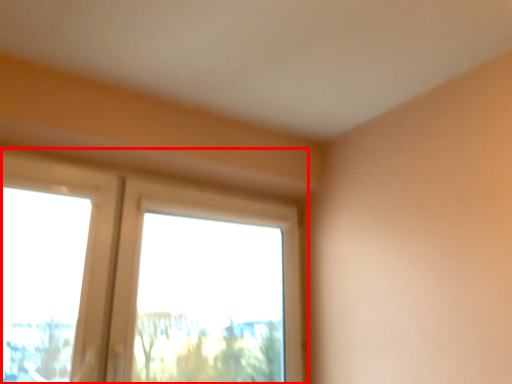
Question: In this image, where is window (annotated by the red box) located relative to window screen?

Choices:
 (A) right
 (B) left

Answer: (A)